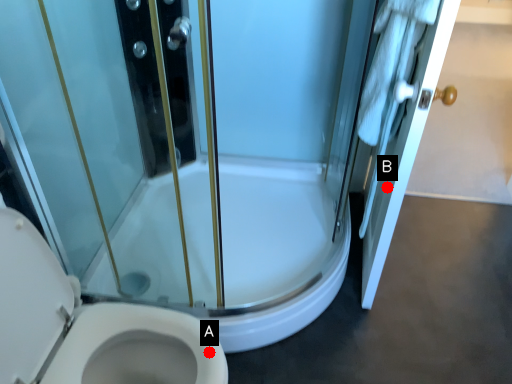
Question: Two points are circled on the image, labeled by A and B beside each circle. Which of the following is the farthest from the observer?

Choices:
 (A) A is further
 (B) B is further

Answer: (B)